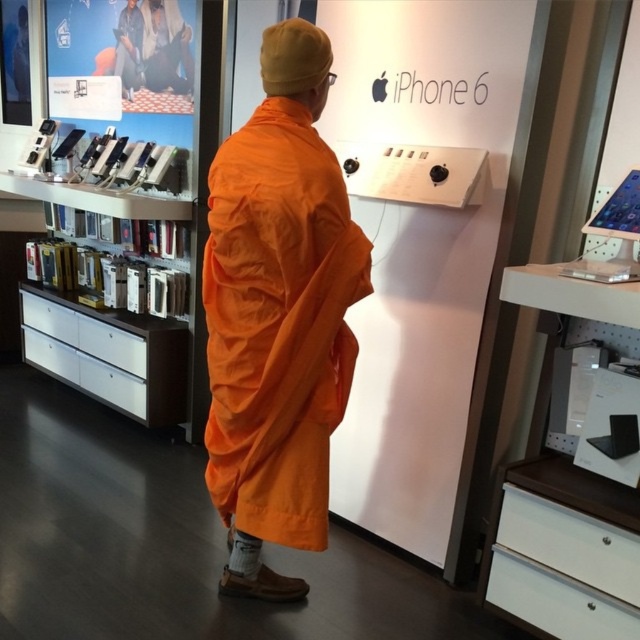
You are an interior designer assessing the Apple store layout. You notice the orange fabric at center and the white matte bookshelf at lower right. Which object occupies more space in the scene?

Answer: The orange fabric at center occupies more space in the scene as it is bigger than the white matte bookshelf at lower right.